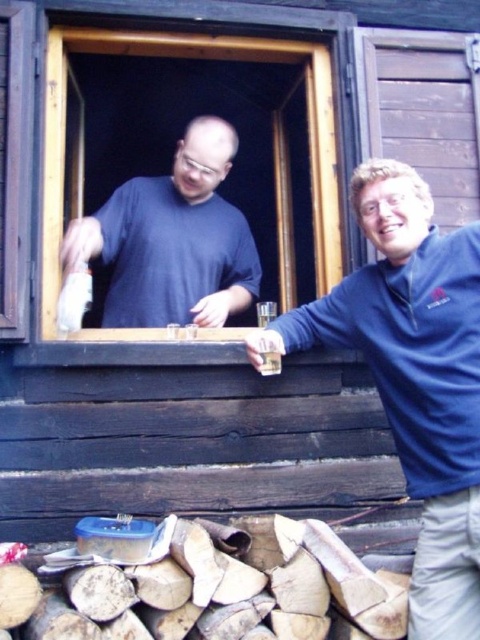
Question: Based on their relative distances, which object is farther from the blue fleece jacket at right?

Choices:
 (A) wooden frame at upper center
 (B) matte blue shirt at window
 (C) translucent glass beverage at window

Answer: (B)

Question: Does blue fleece jacket at right lie in front of wooden frame at upper center?

Choices:
 (A) yes
 (B) no

Answer: (A)

Question: Is blue fleece jacket at right in front of matte blue shirt at window?

Choices:
 (A) no
 (B) yes

Answer: (B)

Question: Which object is the farthest from the matte blue shirt at window?

Choices:
 (A) blue fleece jacket at right
 (B) translucent glass beverage at window

Answer: (B)

Question: Where is matte blue shirt at window located in relation to translucent glass beverage at window in the image?

Choices:
 (A) above
 (B) below

Answer: (A)

Question: Which of the following is the farthest from the observer?

Choices:
 (A) (272, 358)
 (B) (372, 304)
 (C) (190, 252)

Answer: (C)